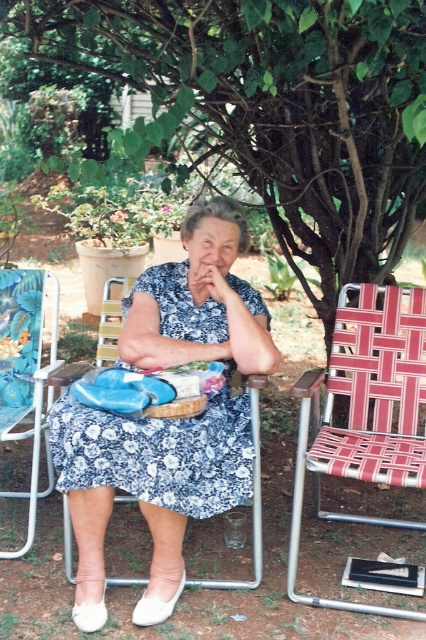
You are an assistant helping someone choose outfits for a garden party. The person wants to ensure their outfit doesn not clash with the blue fabric folding chair at left. Given that the blue floral dress at center is available, would you recommend it based on size comparison alone?

The blue floral dress at center is larger in size than the blue fabric folding chair at left. Since the dress is larger, it might draw more visual attention and could potentially clash with the chair in terms of size contrast. However, color coordination would also play a role, but based purely on size comparison, the dress may not be the best choice to avoid clashing with the chair.

You are a photographer trying to capture the blue floral dress at center and the blue fabric folding chair at left in a single shot. Since both are blue, how can you ensure the dress stands out more than the chair in the photo?

The blue floral dress at center is positioned over the blue fabric folding chair at left, so by focusing the camera on the dress and using a shallow depth of field, the dress will be in sharp focus while the chair behind it becomes slightly blurred, making the dress stand out more.